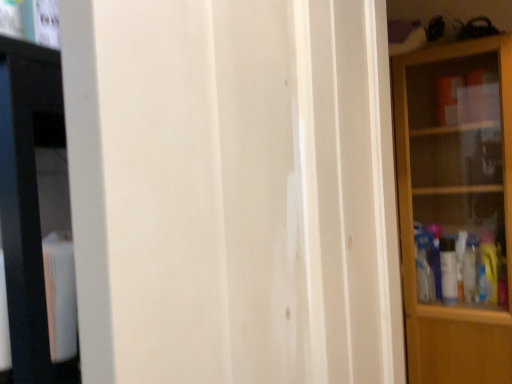
Question: Relative to white wood screen door at center, is transparent glass cabinet at right in front or behind?

Choices:
 (A) behind
 (B) front

Answer: (A)

Question: Based on their positions, is transparent glass cabinet at right located to the left or right of white wood screen door at center?

Choices:
 (A) right
 (B) left

Answer: (A)

Question: From a real-world perspective, is transparent glass cabinet at right above or below white wood screen door at center?

Choices:
 (A) below
 (B) above

Answer: (A)

Question: Considering the positions of white wood screen door at center and transparent glass cabinet at right in the image, is white wood screen door at center bigger or smaller than transparent glass cabinet at right?

Choices:
 (A) small
 (B) big

Answer: (A)

Question: Would you say white wood screen door at center is to the left or to the right of transparent glass cabinet at right in the picture?

Choices:
 (A) right
 (B) left

Answer: (B)

Question: From a real-world perspective, is white wood screen door at center above or below transparent glass cabinet at right?

Choices:
 (A) above
 (B) below

Answer: (A)

Question: Is point (251, 375) positioned closer to the camera than point (436, 190)?

Choices:
 (A) farther
 (B) closer

Answer: (B)